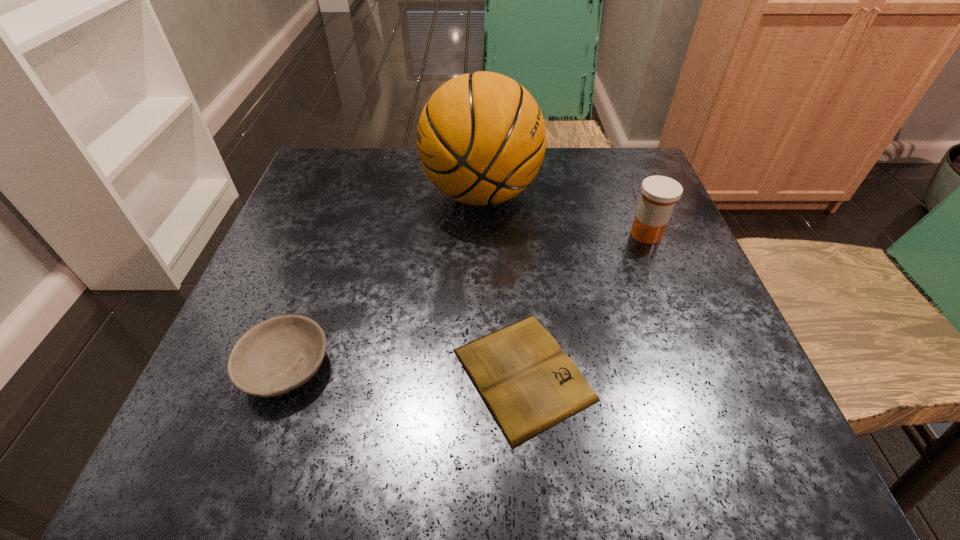
This screenshot has width=960, height=540. In order to click on vacant area located 0.080m on the label of the rightmost object in this screenshot , I will do `click(587, 234)`.

The width and height of the screenshot is (960, 540). What are the coordinates of `vacant region located on the label of the rightmost object` in the screenshot? It's located at (497, 234).

The image size is (960, 540). What are the coordinates of `vacant region located on the back of the bowl` in the screenshot? It's located at (333, 234).

At what (x,y) coordinates should I click in order to perform the action: click on free space located on the left of the shortest object. Please return your answer as a coordinate pair (x, y). This screenshot has height=540, width=960. Looking at the image, I should click on (325, 374).

Image resolution: width=960 pixels, height=540 pixels. In order to click on object at the far edge in this screenshot , I will do `click(481, 138)`.

The image size is (960, 540). Identify the location of bowl at the near edge. (280, 354).

Find the location of a particular element. book that is positioned at the near edge is located at coordinates (529, 385).

This screenshot has width=960, height=540. What are the coordinates of `object that is positioned at the left edge` in the screenshot? It's located at (280, 354).

The image size is (960, 540). In order to click on object that is positioned at the right edge in this screenshot , I will do `click(659, 193)`.

Identify the location of object that is at the near left corner. (280, 354).